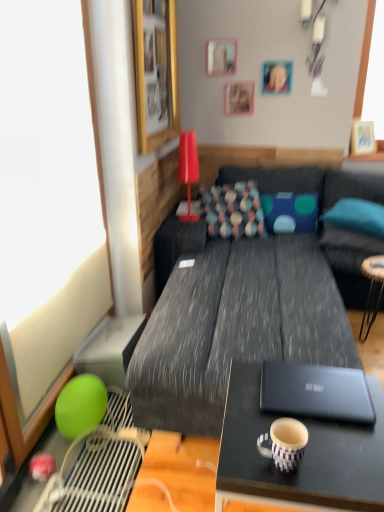
I want to click on free spot in front of black matte laptop at center, so coord(332,454).